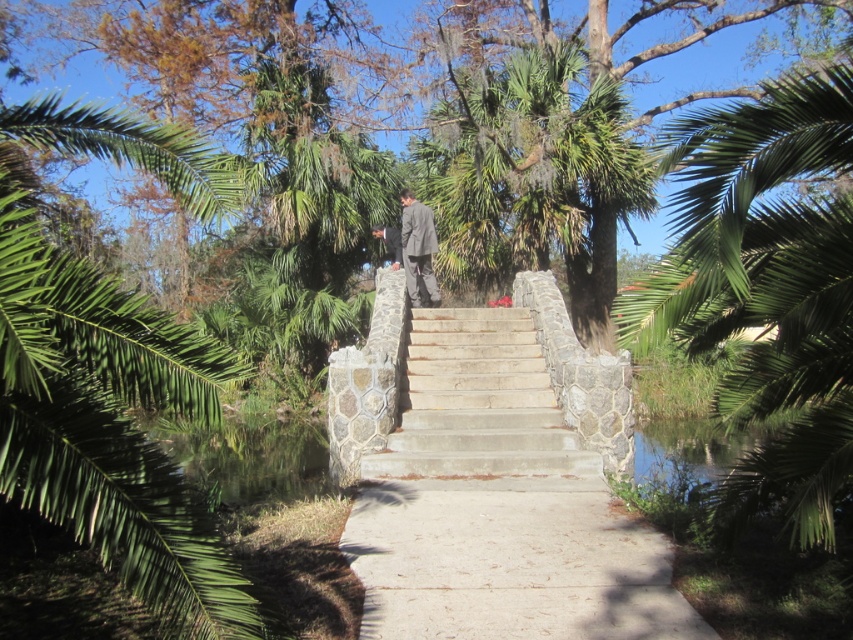
Who is shorter, concrete/stone path at center or concrete at center?

concrete/stone path at center is shorter.

Does concrete/stone path at center come in front of concrete at center?

No, it is behind concrete at center.

Between point (537, 460) and point (437, 632), which one is positioned in front?

Point (437, 632) is in front.

You are a GUI agent. You are given a task and a screenshot of the screen. Output one action in this format:
    pyautogui.click(x=<x>, y=<y>)
    Task: Click on the concrete/stone path at center
    This screenshot has height=640, width=853.
    Given the screenshot: What is the action you would take?
    pos(498,504)

Locate an element on the screen. This screenshot has width=853, height=640. concrete/stone path at center is located at coordinates (498, 504).

Which is in front, point (534, 513) or point (778, 170)?

Point (778, 170)

Find the location of a particular element. The width and height of the screenshot is (853, 640). concrete/stone path at center is located at coordinates (498, 504).

Is green leafy palm tree at right thinner than concrete at center?

No.

Between point (752, 376) and point (462, 502), which one is positioned in front?

Point (752, 376) is more forward.

The width and height of the screenshot is (853, 640). What do you see at coordinates (767, 285) in the screenshot?
I see `green leafy palm tree at right` at bounding box center [767, 285].

The height and width of the screenshot is (640, 853). What are the coordinates of `green leafy palm tree at right` in the screenshot? It's located at point(767,285).